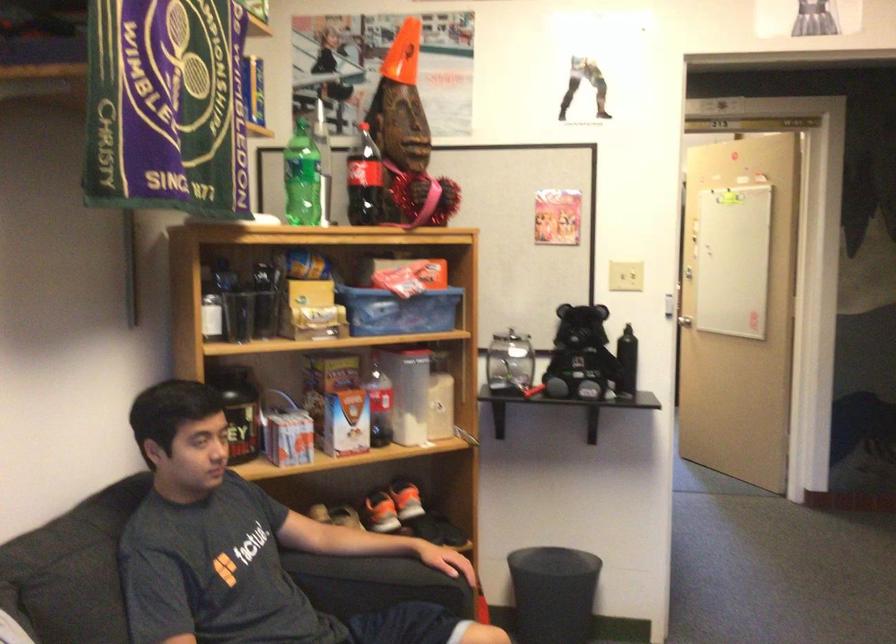
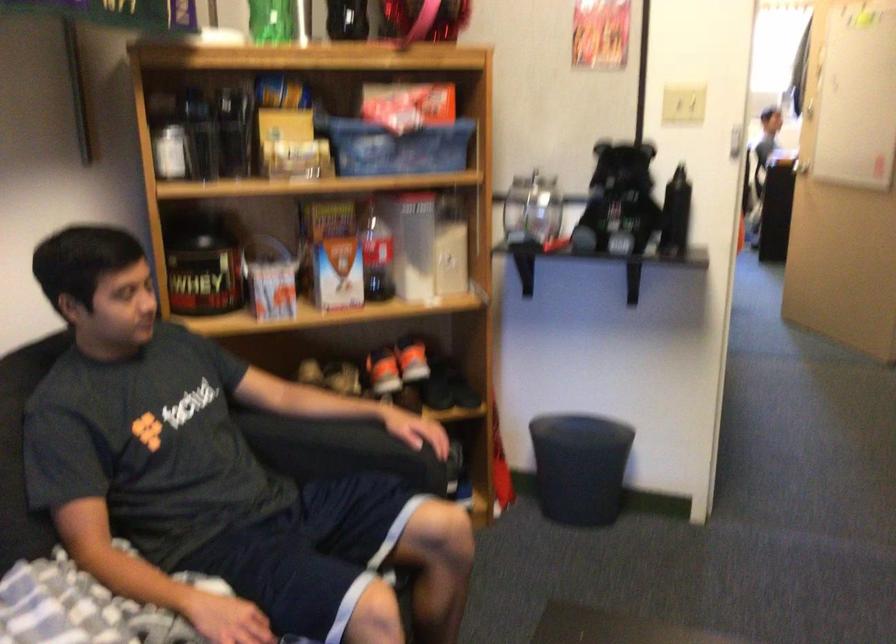
Locate, in the second image, the point that corresponds to pixel 632 281 in the first image.

(682, 106)